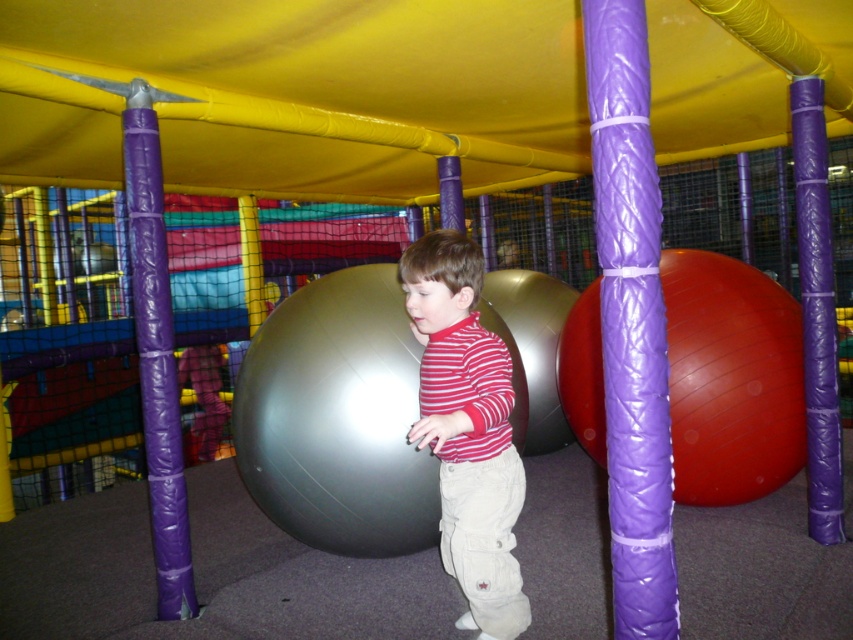
Question: Does purple quilted pole at center have a lesser width compared to rubberized red ball at right?

Choices:
 (A) no
 (B) yes

Answer: (B)

Question: Which of the following is the farthest from the observer?

Choices:
 (A) (381, 276)
 (B) (663, 333)
 (C) (755, 477)

Answer: (C)

Question: Is purple quilted pole at center above striped cotton shirt at center?

Choices:
 (A) no
 (B) yes

Answer: (B)

Question: Which point is closer to the camera taking this photo?

Choices:
 (A) (656, 285)
 (B) (462, 280)
 (C) (160, 304)

Answer: (A)

Question: Which object is farther from the camera taking this photo?

Choices:
 (A) purple quilted pole at center
 (B) striped cotton shirt at center
 (C) rubberized red ball at right

Answer: (C)

Question: Does metallic gray ball at center have a smaller size compared to striped cotton shirt at center?

Choices:
 (A) no
 (B) yes

Answer: (A)